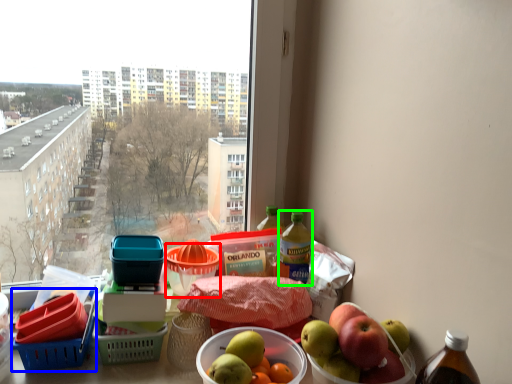
Question: Which is farther away from basket (highlighted by a red box)? basket (highlighted by a blue box) or bottle (highlighted by a green box)?

Choices:
 (A) basket
 (B) bottle

Answer: (A)